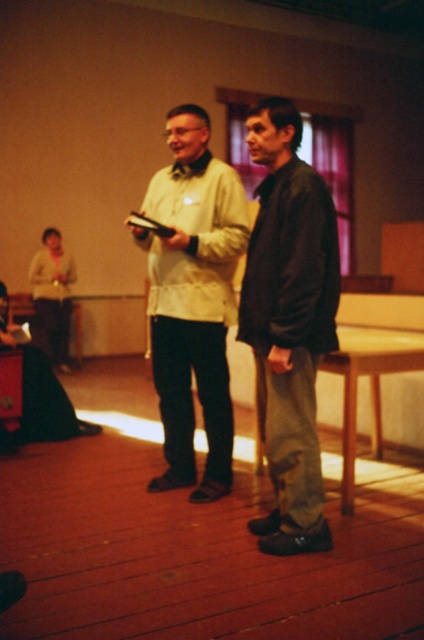
Question: Does dark brown leather jacket at center appear under matte beige jacket at center?

Choices:
 (A) no
 (B) yes

Answer: (B)

Question: Can you confirm if dark brown leather jacket at center is positioned below matte beige jacket at center?

Choices:
 (A) no
 (B) yes

Answer: (B)

Question: Does dark brown leather jacket at center come behind matte beige jacket at center?

Choices:
 (A) no
 (B) yes

Answer: (A)

Question: Which point is closer to the camera?

Choices:
 (A) (287, 376)
 (B) (155, 486)

Answer: (A)